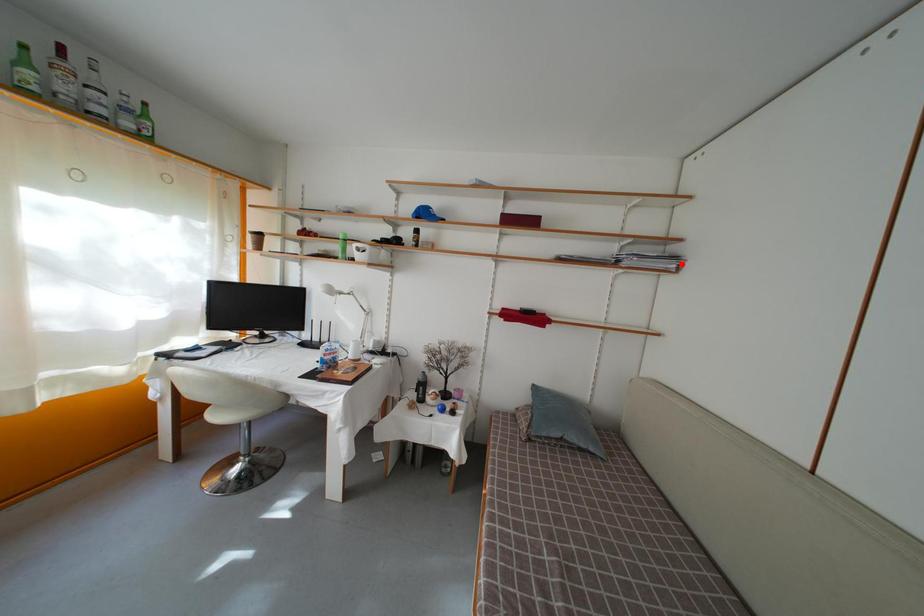
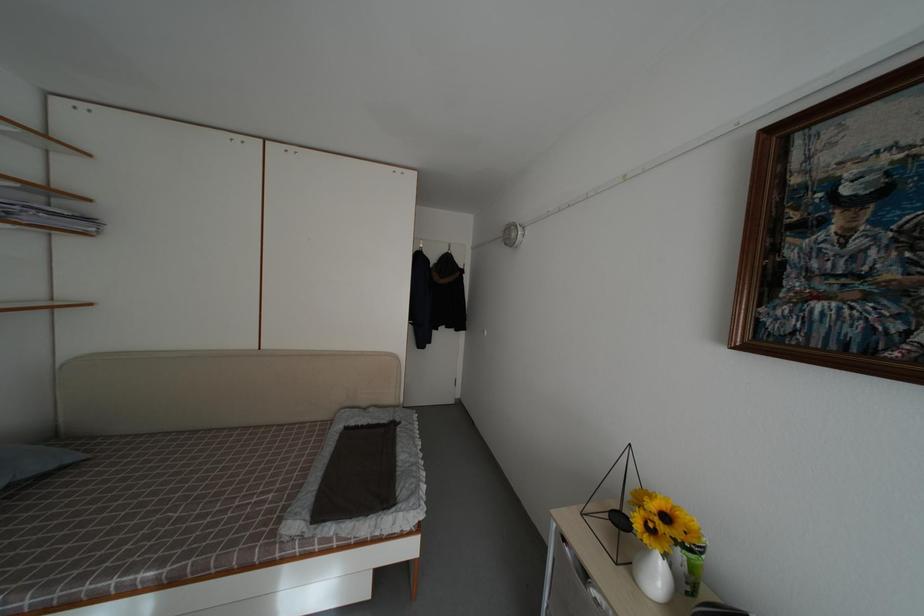
Locate, in the second image, the point that corresponds to the highlighted location in the first image.

(94, 225)